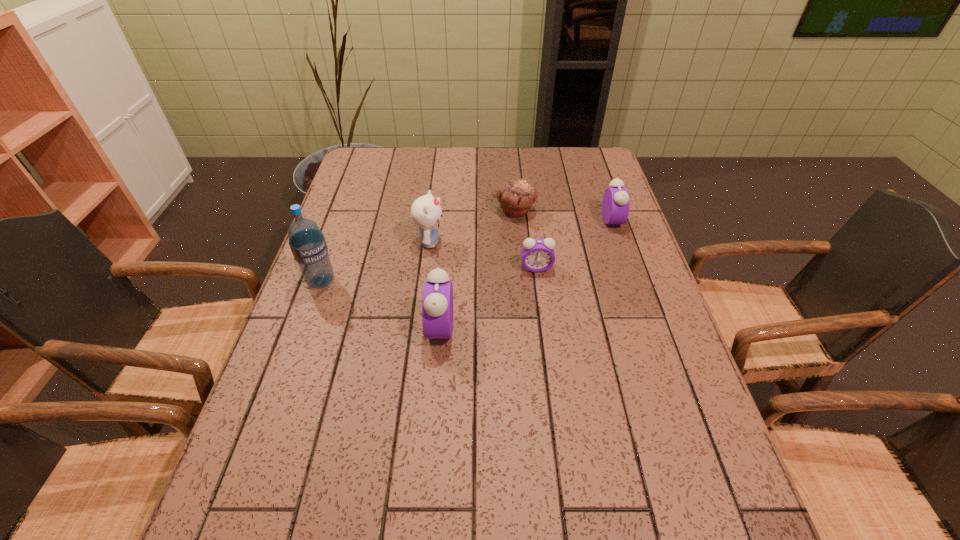
Locate an element on the screen. The image size is (960, 540). the leftmost alarm clock is located at coordinates (437, 304).

Identify the location of the nearest alarm clock. This screenshot has width=960, height=540. (437, 304).

Find the location of `the shortest alarm clock`. the shortest alarm clock is located at coordinates (537, 255).

Where is `the second alarm clock from left to right`? The height and width of the screenshot is (540, 960). the second alarm clock from left to right is located at coordinates (537, 255).

I want to click on the farthest alarm clock, so click(615, 207).

Where is `the rightmost object`? This screenshot has height=540, width=960. the rightmost object is located at coordinates (615, 207).

This screenshot has height=540, width=960. Find the location of `the tallest object`. the tallest object is located at coordinates (307, 243).

Find the location of a particular element. The width and height of the screenshot is (960, 540). the leftmost object is located at coordinates (307, 243).

Where is `muffin`? muffin is located at coordinates (516, 196).

Locate an element on the screen. The width and height of the screenshot is (960, 540). kitten is located at coordinates (426, 212).